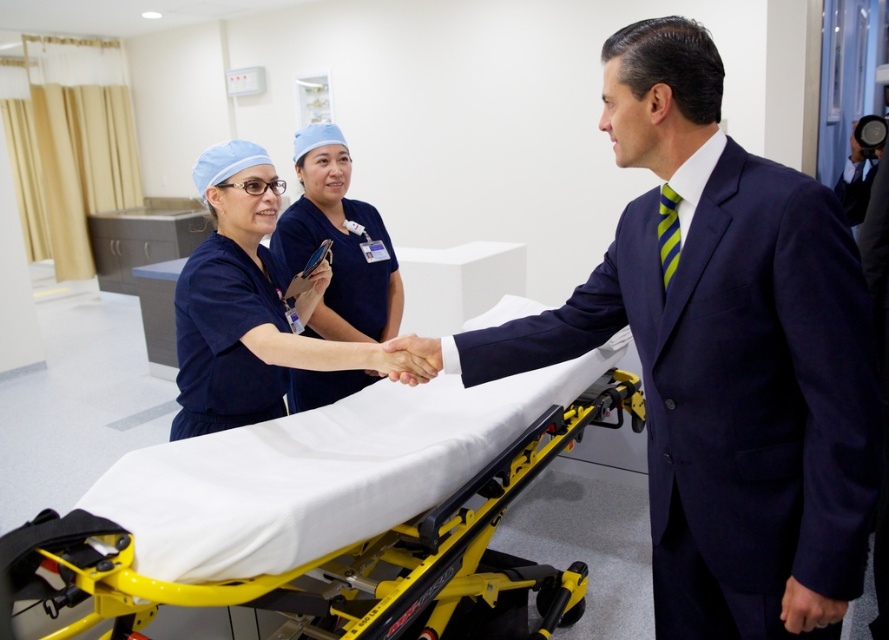
Question: Can you confirm if navy blue scrubs at center is wider than blue scrubs at center?

Choices:
 (A) yes
 (B) no

Answer: (A)

Question: Is yellow metallic stretcher at center above blue scrubs at center?

Choices:
 (A) no
 (B) yes

Answer: (A)

Question: Which object appears closest to the camera in this image?

Choices:
 (A) yellow metallic stretcher at center
 (B) blue scrubs at center
 (C) navy blue scrubs at center
 (D) navy blue suit at center

Answer: (D)

Question: Is navy blue suit at center below navy blue scrubs at center?

Choices:
 (A) yes
 (B) no

Answer: (A)

Question: Which of the following is the farthest from the observer?

Choices:
 (A) yellow metallic stretcher at center
 (B) navy blue scrubs at center
 (C) navy blue suit at center

Answer: (B)

Question: Estimate the real-world distances between objects in this image. Which object is closer to the blue scrubs at center?

Choices:
 (A) navy blue scrubs at center
 (B) navy blue suit at center
 (C) yellow metallic stretcher at center

Answer: (A)